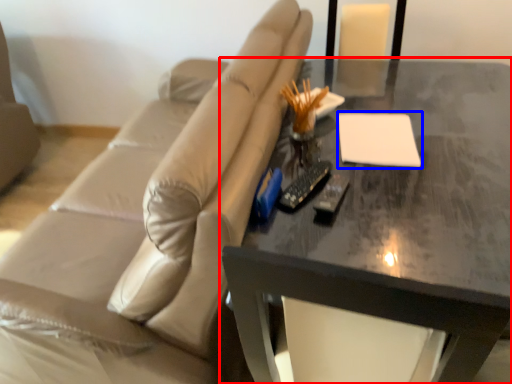
Question: Which object is closer to the camera taking this photo, table (highlighted by a red box) or notepad (highlighted by a blue box)?

Choices:
 (A) table
 (B) notepad

Answer: (A)